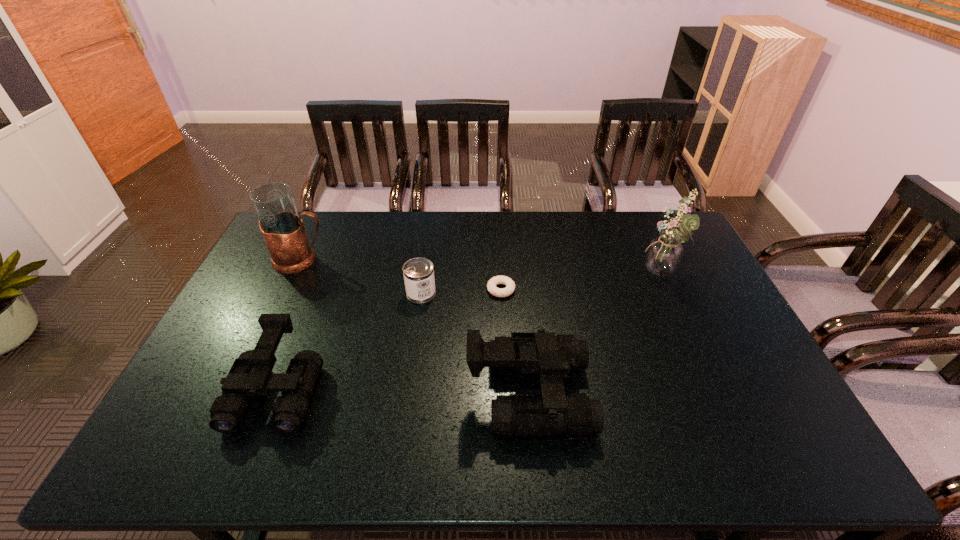
Where is `the third shortest object`? Image resolution: width=960 pixels, height=540 pixels. the third shortest object is located at coordinates (250, 375).

Identify the location of the left binoculars. Image resolution: width=960 pixels, height=540 pixels. (250, 375).

The image size is (960, 540). I want to click on the taller binoculars, so click(553, 357).

You are a GUI agent. You are given a task and a screenshot of the screen. Output one action in this format:
    pyautogui.click(x=<x>, y=<y>)
    Task: Click on the third tallest object
    
    Given the screenshot: What is the action you would take?
    pyautogui.click(x=553, y=357)

Locate an element on the screen. This screenshot has height=540, width=960. pitcher is located at coordinates (282, 228).

At what (x,y) coordinates should I click in order to perform the action: click on the shortest object. Please return your answer as a coordinate pair (x, y). This screenshot has width=960, height=540. Looking at the image, I should click on (491, 285).

At what (x,y) coordinates should I click in order to perform the action: click on the rightmost object. Please return your answer as a coordinate pair (x, y). This screenshot has height=540, width=960. Looking at the image, I should click on (663, 256).

Locate an element on the screen. The image size is (960, 540). the fifth tallest object is located at coordinates (418, 273).

You are a GUI agent. You are given a task and a screenshot of the screen. Output one action in this format:
    pyautogui.click(x=<x>, y=<y>)
    Task: Click on the can
    This screenshot has width=960, height=540.
    Given the screenshot: What is the action you would take?
    pyautogui.click(x=418, y=273)

The image size is (960, 540). Identify the location of vacant space located 0.290m on the front lenses of the fourth shortest object. (702, 394).